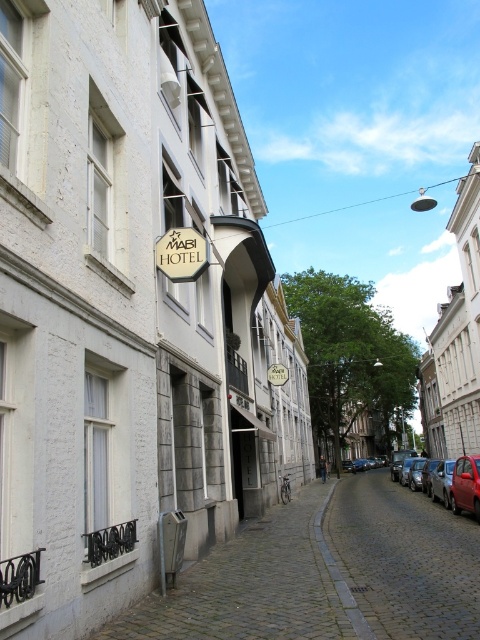
You are a tourist standing in front of the MABI HOTEL and want to take a photo that includes both the white plastic sign at upper center and the shiny red car at right. Based on their positions, which object should you place closer to the left side of your camera frame?

The white plastic sign at upper center should be placed closer to the left side of your camera frame because it is positioned on the left side of the shiny red car at right.

You are a tourist in this European city and want to find the MABI HOTEL. You see the white stone hotel at center and the white plastic sign at upper center. Which one should you approach to reach the hotel?

You should approach the white stone hotel at center because it is the actual building of the MABI HOTEL, while the white plastic sign at upper center is likely just a nearby sign and not the hotel itself.

You are standing on the cobblestone pavement in front of the MABI HOTEL. You see a point marked at coordinates point (456, 337). Based on the scene description, can you determine which building this point is located on?

The point (456, 337) is on the white stone building at upper right.